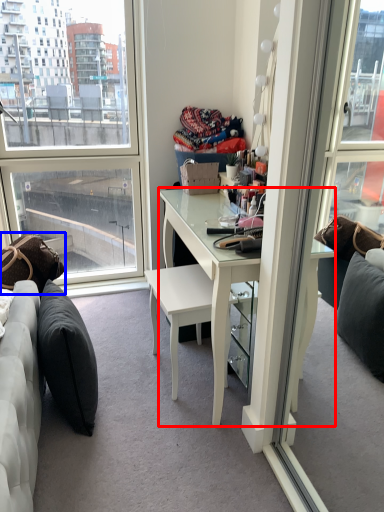
Question: Which object is closer to the camera taking this photo, desk (highlighted by a red box) or pillow (highlighted by a blue box)?

Choices:
 (A) desk
 (B) pillow

Answer: (A)